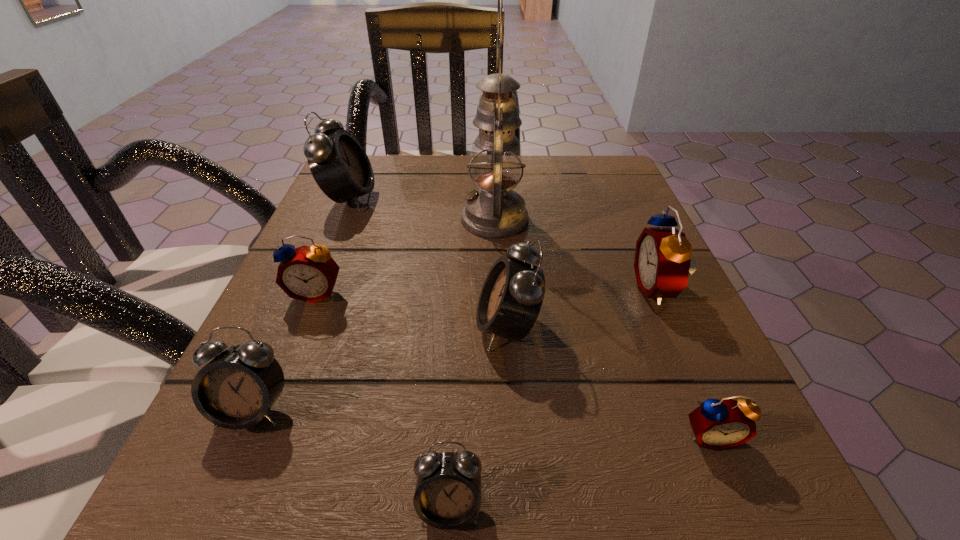
At what (x,y) coordinates should I click in order to perform the action: click on object that is the second nearest to the biggest red alarm clock. Please return your answer as a coordinate pair (x, y). This screenshot has height=540, width=960. Looking at the image, I should click on (495, 211).

At what (x,y) coordinates should I click in order to perform the action: click on object that can be found as the closest to the second farthest white alarm clock. Please return your answer as a coordinate pair (x, y). The height and width of the screenshot is (540, 960). Looking at the image, I should click on (495, 211).

What are the coordinates of `alarm clock that is the sixth nearest to the nearest alarm clock` in the screenshot? It's located at (340, 166).

What are the coordinates of `alarm clock identified as the fourth closest to the third nearest white alarm clock` in the screenshot? It's located at (309, 274).

Locate which white alarm clock is the closest to the biggest white alarm clock. Please provide its 2D coordinates. Your answer should be formatted as a tuple, i.e. [(x, y)], where the tuple contains the x and y coordinates of a point satisfying the conditions above.

[(511, 298)]

Identify which white alarm clock is the third nearest to the smallest red alarm clock. Please provide its 2D coordinates. Your answer should be formatted as a tuple, i.e. [(x, y)], where the tuple contains the x and y coordinates of a point satisfying the conditions above.

[(235, 390)]

In order to click on red alarm clock object that ranks as the closest to the second farthest white alarm clock in this screenshot , I will do `click(662, 263)`.

Locate an element on the screen. The width and height of the screenshot is (960, 540). red alarm clock that is the closest to the second nearest white alarm clock is located at coordinates (309, 274).

Locate an element on the screen. The width and height of the screenshot is (960, 540). vacant space that satisfies the following two spatial constraints: 1. on the face of the farthest alarm clock; 2. on the right side of the oil lamp is located at coordinates (341, 219).